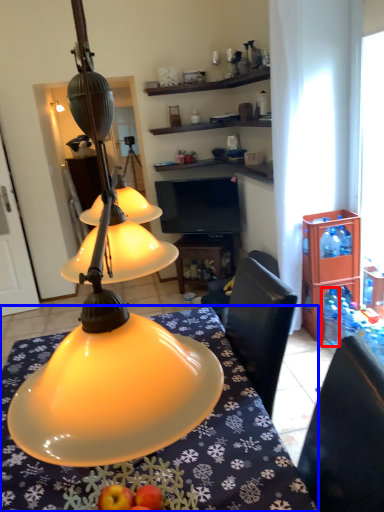
Question: Among these objects, which one is farthest to the camera, bottle (highlighted by a red box) or desk (highlighted by a blue box)?

Choices:
 (A) bottle
 (B) desk

Answer: (A)